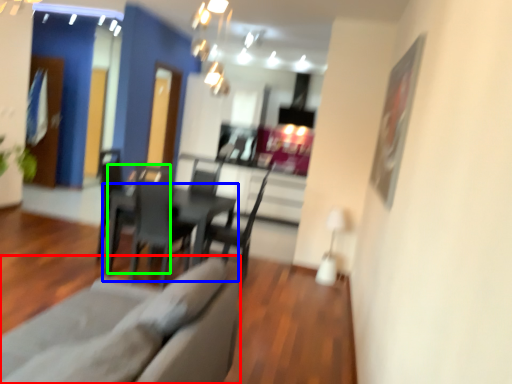
Question: Which is farther away from couch (highlighted by a red box)? table (highlighted by a blue box) or armchair (highlighted by a green box)?

Choices:
 (A) table
 (B) armchair

Answer: (A)